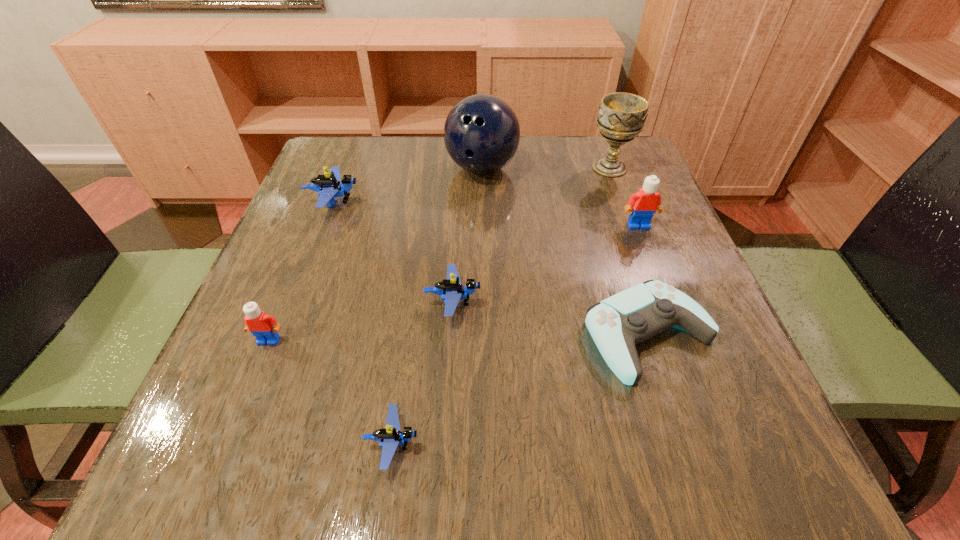
Identify the location of vacant area that lies between the leftmost blue Lego and the white chalice. (472, 185).

This screenshot has height=540, width=960. Find the location of `vacant region between the biggest blue Lego and the white chalice`. vacant region between the biggest blue Lego and the white chalice is located at coordinates (472, 185).

Locate an element on the screen. empty space between the leftmost blue Lego and the control is located at coordinates (492, 268).

The image size is (960, 540). Find the location of `vacant region between the bigger white Lego and the biggest blue Lego`. vacant region between the bigger white Lego and the biggest blue Lego is located at coordinates (486, 214).

Locate an element on the screen. Image resolution: width=960 pixels, height=540 pixels. object that ranks as the fourth closest to the bigger white Lego is located at coordinates (451, 290).

Where is `the second closest object to the nearest object`? The width and height of the screenshot is (960, 540). the second closest object to the nearest object is located at coordinates (262, 326).

Identify which Lego is located as the nearest to the chalice. Please provide its 2D coordinates. Your answer should be formatted as a tuple, i.e. [(x, y)], where the tuple contains the x and y coordinates of a point satisfying the conditions above.

[(647, 200)]

Identify which Lego is located as the second nearest to the third tallest object. Please provide its 2D coordinates. Your answer should be formatted as a tuple, i.e. [(x, y)], where the tuple contains the x and y coordinates of a point satisfying the conditions above.

[(390, 437)]

Find the location of a particular element. blue Lego that stands as the third closest to the left white Lego is located at coordinates (329, 186).

Where is `blue Lego that is the second nearest to the control`? blue Lego that is the second nearest to the control is located at coordinates (390, 437).